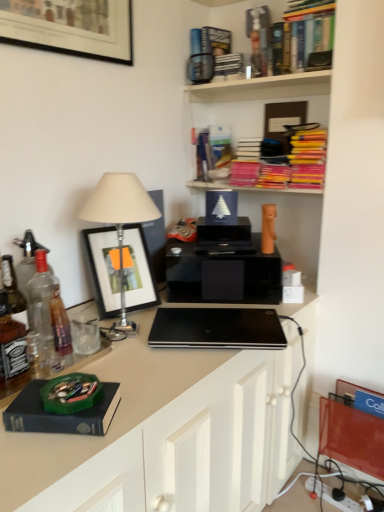
Question: In terms of width, does clear glass bottle at left look wider or thinner when compared to black matte laptop at center?

Choices:
 (A) wide
 (B) thin

Answer: (B)

Question: Is clear glass bottle at left in front of or behind black matte laptop at center in the image?

Choices:
 (A) behind
 (B) front

Answer: (B)

Question: Which of these objects is positioned farthest from the clear glass bottle at left?

Choices:
 (A) white plastic power strip at lower right
 (B) hardcover books at upper right, which is counted as the 2th book, starting from the top
 (C) hardcover books at upper center, marked as the 1th shelf in a top-to-bottom arrangement
 (D) pink matte books at upper center, arranged as the first shelf when ordered from the bottom
 (E) black matte laptop at center

Answer: (B)

Question: Estimate the real-world distances between objects in this image. Which object is farther from the clear glass bottle at left?

Choices:
 (A) pink matte books at upper center, arranged as the first shelf when ordered from the bottom
 (B) wooden bookshelf at upper center, marked as the second shelf in a bottom-to-top arrangement
 (C) hardcover books at upper right, placed as the third book when sorted from bottom to top
 (D) hardcover book at upper center, the 4th book positioned from the bottom
 (E) black matte laptop at center

Answer: (C)